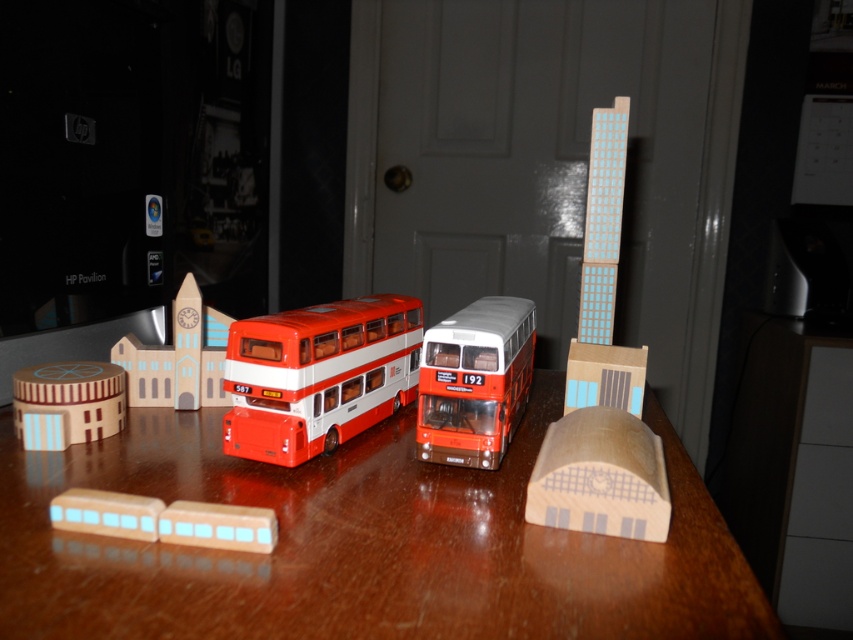
Question: Is wooden skyscraper at center to the left of wooden building at lower left from the viewer's perspective?

Choices:
 (A) no
 (B) yes

Answer: (A)

Question: Which of the following is the closest to the observer?

Choices:
 (A) (45, 419)
 (B) (286, 378)
 (C) (38, 580)

Answer: (C)

Question: Is matte red and white double-decker bus at center thinner than matte red bus at center?

Choices:
 (A) yes
 (B) no

Answer: (B)

Question: Which object is the closest to the wooden building at left?

Choices:
 (A) matte red bus at center
 (B) wooden train at lower left
 (C) wooden skyscraper at center
 (D) matte red and white double-decker bus at center

Answer: (D)

Question: Which of these objects is positioned farthest from the brown polished wood table at center?

Choices:
 (A) wooden train at lower left
 (B) matte red bus at center
 (C) wooden building at lower left

Answer: (C)

Question: Is matte red bus at center wider than wooden building at lower left?

Choices:
 (A) no
 (B) yes

Answer: (B)